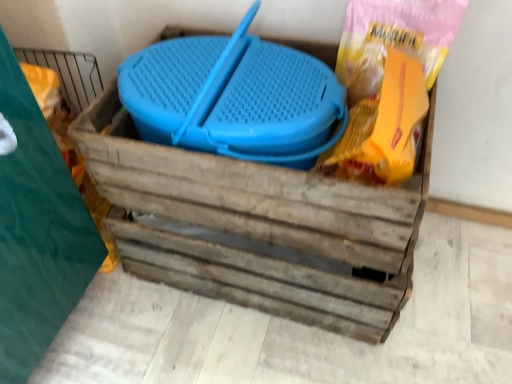
This screenshot has width=512, height=384. What do you see at coordinates (260, 225) in the screenshot?
I see `blue plastic container at center` at bounding box center [260, 225].

Where is `blue plastic container at center`? The height and width of the screenshot is (384, 512). blue plastic container at center is located at coordinates (260, 225).

This screenshot has height=384, width=512. Identify the location of blue plastic container at center. (260, 225).